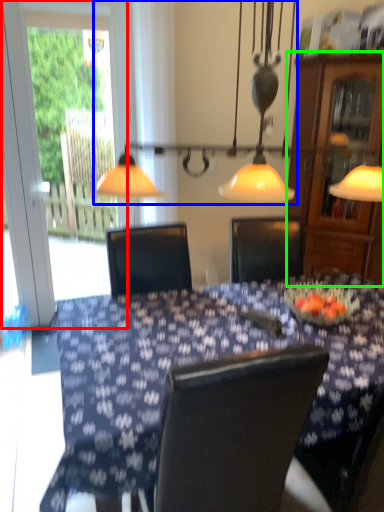
Question: Estimate the real-world distances between objects in this image. Which object is farther from screen door (highlighted by a red box), lamp (highlighted by a blue box) or cabinetry (highlighted by a green box)?

Choices:
 (A) lamp
 (B) cabinetry

Answer: (B)